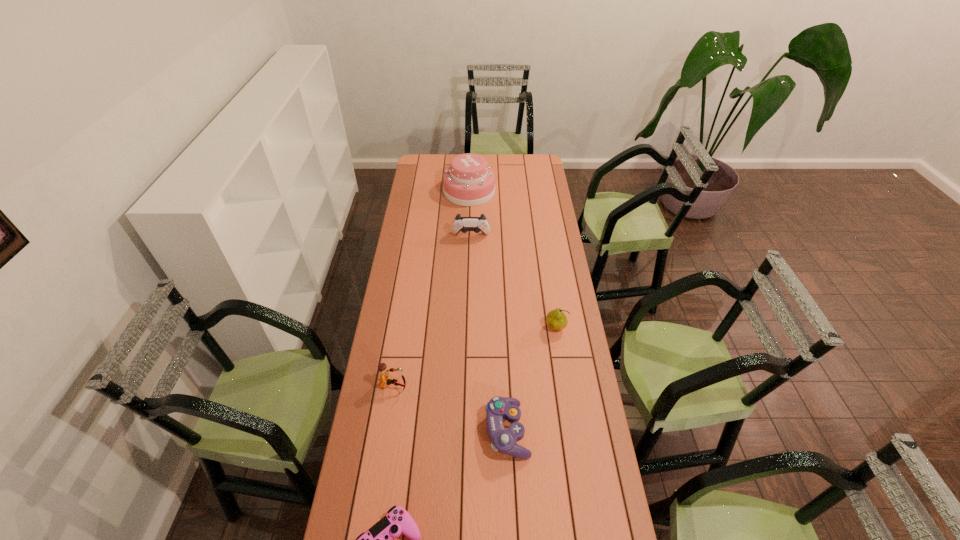
The height and width of the screenshot is (540, 960). In order to click on vacant area that lies between the second farthest control and the pear in this screenshot , I will do `click(532, 379)`.

I want to click on free spot between the Lego and the second farthest object, so click(432, 311).

The image size is (960, 540). I want to click on empty space between the fourth nearest object and the fifth tallest object, so click(x=532, y=379).

Where is `vacant space in between the third farthest object and the second nearest object`? This screenshot has width=960, height=540. vacant space in between the third farthest object and the second nearest object is located at coordinates (532, 379).

This screenshot has height=540, width=960. What are the coordinates of `vacant area that lies between the rightmost object and the Lego` in the screenshot? It's located at click(x=474, y=357).

Find the location of `vacant area that lies between the fifth nearest object and the pear`. vacant area that lies between the fifth nearest object and the pear is located at coordinates (514, 282).

Identify the location of free space that is in between the rightmost object and the farthest object. The width and height of the screenshot is (960, 540). (513, 260).

Locate which object is the fourth closest to the shortest object. Please provide its 2D coordinates. Your answer should be formatted as a tuple, i.e. [(x, y)], where the tuple contains the x and y coordinates of a point satisfying the conditions above.

[(463, 224)]

Locate an element on the screen. This screenshot has width=960, height=540. object that is the closest to the Lego is located at coordinates (498, 408).

Identify which control is located as the nearest to the second tallest control. Please provide its 2D coordinates. Your answer should be formatted as a tuple, i.e. [(x, y)], where the tuple contains the x and y coordinates of a point satisfying the conditions above.

[(379, 539)]